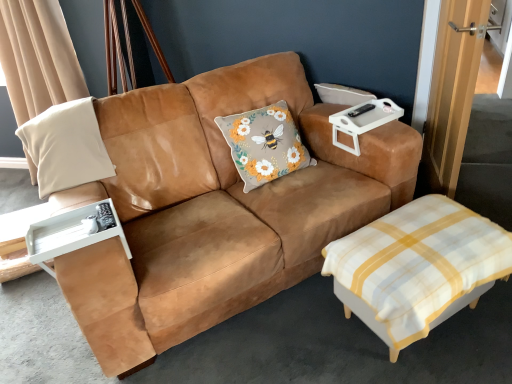
Question: Should I look upward or downward to see wooden door at right?

Choices:
 (A) up
 (B) down

Answer: (A)

Question: Is white checkered ottoman at lower right not close to suede tan couch at center?

Choices:
 (A) yes
 (B) no

Answer: (B)

Question: Could you tell me if white checkered ottoman at lower right is facing suede tan couch at center?

Choices:
 (A) yes
 (B) no

Answer: (B)

Question: Can you confirm if white checkered ottoman at lower right is thinner than suede tan couch at center?

Choices:
 (A) no
 (B) yes

Answer: (B)

Question: Considering the relative positions of white checkered ottoman at lower right and suede tan couch at center in the image provided, is white checkered ottoman at lower right to the left of suede tan couch at center from the viewer's perspective?

Choices:
 (A) yes
 (B) no

Answer: (B)

Question: Could suede tan couch at center be considered to be inside white checkered ottoman at lower right?

Choices:
 (A) yes
 (B) no

Answer: (B)

Question: From the image's perspective, is white checkered ottoman at lower right beneath suede tan couch at center?

Choices:
 (A) yes
 (B) no

Answer: (A)

Question: From a real-world perspective, is suede tan couch at center physically above white plastic tray at upper right?

Choices:
 (A) yes
 (B) no

Answer: (B)

Question: From the image's perspective, is suede tan couch at center on white plastic tray at upper right?

Choices:
 (A) no
 (B) yes

Answer: (A)

Question: Does suede tan couch at center have a greater width compared to white plastic tray at upper right?

Choices:
 (A) no
 (B) yes

Answer: (B)

Question: Does suede tan couch at center turn towards white plastic tray at upper right?

Choices:
 (A) yes
 (B) no

Answer: (B)

Question: Would you say white plastic tray at upper right is part of suede tan couch at center's contents?

Choices:
 (A) no
 (B) yes

Answer: (B)

Question: Is there a large distance between suede tan couch at center and white plastic tray at upper right?

Choices:
 (A) no
 (B) yes

Answer: (A)

Question: From the image's perspective, is white checkered ottoman at lower right located above white plastic tray at upper right?

Choices:
 (A) no
 (B) yes

Answer: (A)